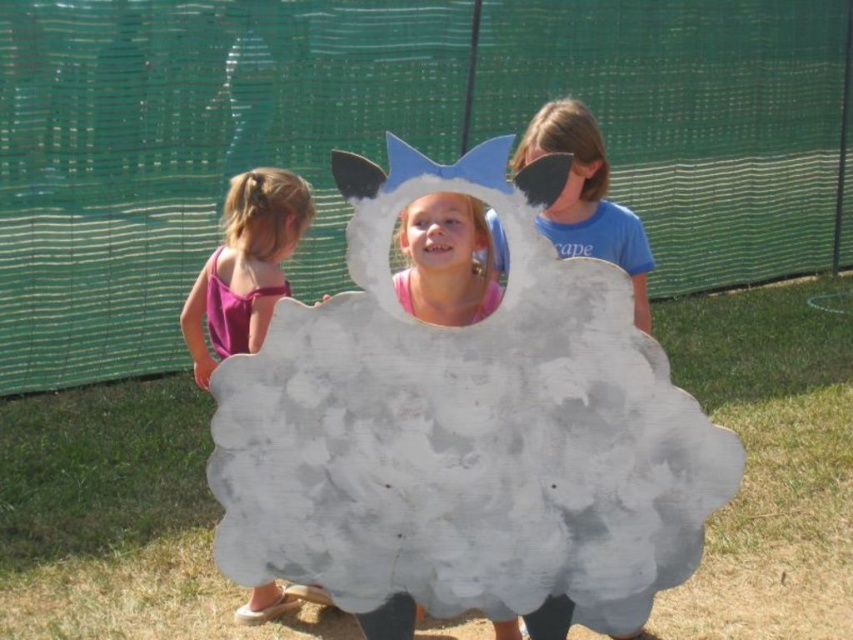
You are a photographer trying to capture a photo of the white cotton cloud at center and the smooth pink shirt at center. The camera requires the two subjects to be at least 20 inches apart to avoid blurring. Based on their current positions, will the photo be blurry?

The white cotton cloud at center and smooth pink shirt at center are 19.07 inches apart, which is less than the required 20 inches. The photo will likely be blurry.

You are standing at point (469, 230) and want to walk to point (682, 502). Which direction should you move in relation to the two points?

You should move forward towards point (682, 502) since it is in front of point (469, 230) from your current position.

You are a photographer trying to capture a photo of the matte blue mask at center and the matte pink dress at left. Which object should you focus on first to ensure it appears sharp in the photo?

You should focus on the matte pink dress at left first because it is closer to the viewer than the matte blue mask at center, ensuring it will be sharp in the photo.